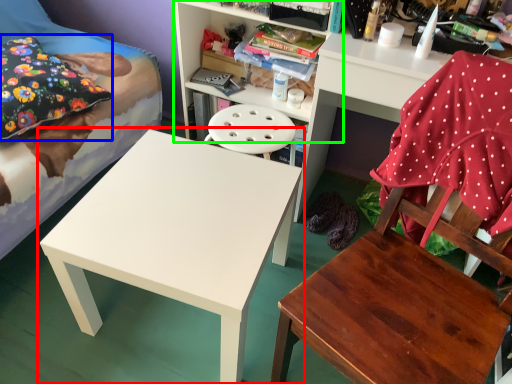
Question: Which object is the farthest from table (highlighted by a red box)? Choose among these: pillow (highlighted by a blue box) or shelf (highlighted by a green box).

Choices:
 (A) pillow
 (B) shelf

Answer: (B)